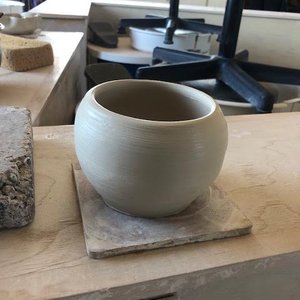
At what (x,y) coordinates should I click in order to perform the action: click on bowl. Please return your answer as a coordinate pair (x, y). The width and height of the screenshot is (300, 300). Looking at the image, I should click on (136, 181).